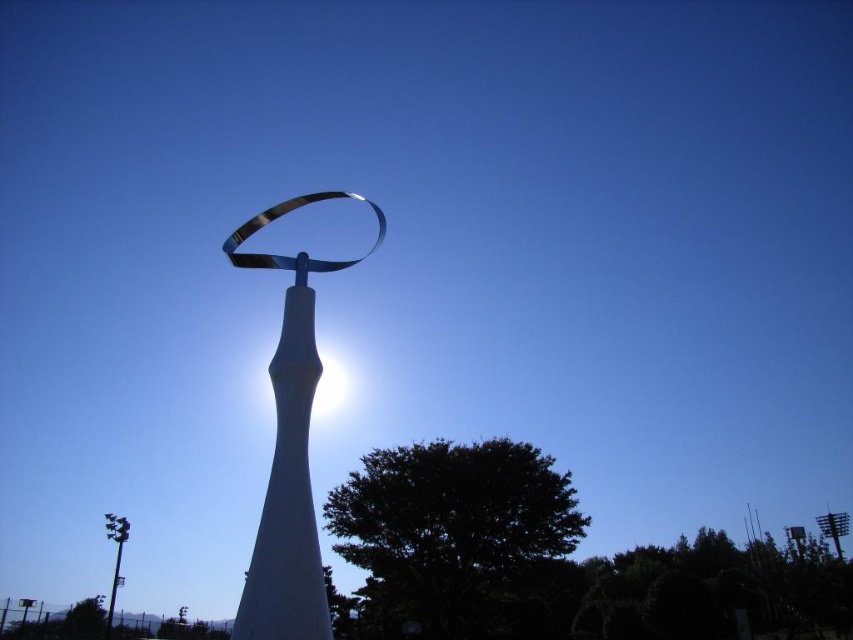
Which is more to the left, sleek silver ribbon at center or metallic gray pole at lower left?

From the viewer's perspective, metallic gray pole at lower left appears more on the left side.

Measure the distance between sleek silver ribbon at center and metallic gray pole at lower left.

sleek silver ribbon at center and metallic gray pole at lower left are 27.16 meters apart.

Identify the location of sleek silver ribbon at center. The image size is (853, 640). (289, 451).